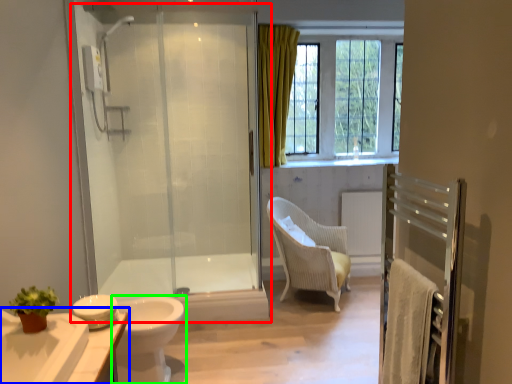
Question: Based on their relative distances, which object is farther from screen door (highlighted by a red box)? Choose from bathroom cabinet (highlighted by a blue box) and toilet (highlighted by a green box).

Choices:
 (A) bathroom cabinet
 (B) toilet

Answer: (A)